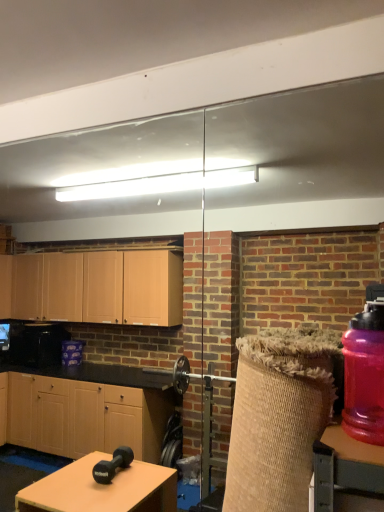
Question: From the image's perspective, is wooden table at center on purple translucent bottle at right?

Choices:
 (A) yes
 (B) no

Answer: (B)

Question: Considering the relative sizes of wooden table at center and purple translucent bottle at right in the image provided, is wooden table at center smaller than purple translucent bottle at right?

Choices:
 (A) yes
 (B) no

Answer: (A)

Question: Would you say purple translucent bottle at right is part of wooden table at center's contents?

Choices:
 (A) no
 (B) yes

Answer: (A)

Question: From the image's perspective, does wooden table at center appear lower than purple translucent bottle at right?

Choices:
 (A) yes
 (B) no

Answer: (A)

Question: Considering the relative sizes of wooden table at center and purple translucent bottle at right in the image provided, is wooden table at center wider than purple translucent bottle at right?

Choices:
 (A) no
 (B) yes

Answer: (A)

Question: Is wooden table at center located outside purple translucent bottle at right?

Choices:
 (A) no
 (B) yes

Answer: (B)

Question: Is purple translucent bottle at right taller than wooden table at center?

Choices:
 (A) yes
 (B) no

Answer: (A)

Question: Is purple translucent bottle at right smaller than wooden table at center?

Choices:
 (A) no
 (B) yes

Answer: (A)

Question: Does purple translucent bottle at right have a greater width compared to wooden table at center?

Choices:
 (A) no
 (B) yes

Answer: (B)

Question: Is purple translucent bottle at right to the left of wooden table at center from the viewer's perspective?

Choices:
 (A) no
 (B) yes

Answer: (A)

Question: From the image's perspective, is purple translucent bottle at right located beneath wooden table at center?

Choices:
 (A) no
 (B) yes

Answer: (A)

Question: From a real-world perspective, is purple translucent bottle at right below wooden table at center?

Choices:
 (A) no
 (B) yes

Answer: (A)

Question: Based on their positions, is wooden table at center located to the left or right of purple translucent bottle at right?

Choices:
 (A) left
 (B) right

Answer: (A)